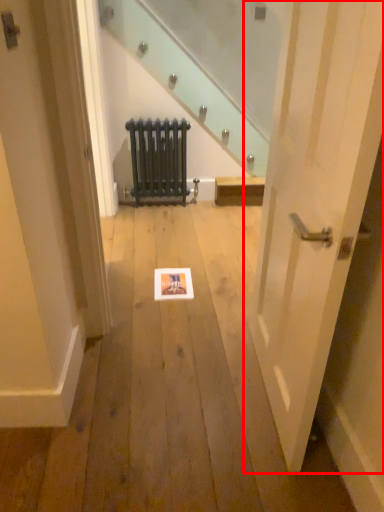
Question: In this image, where is door (annotated by the red box) located relative to radiator?

Choices:
 (A) right
 (B) left

Answer: (A)